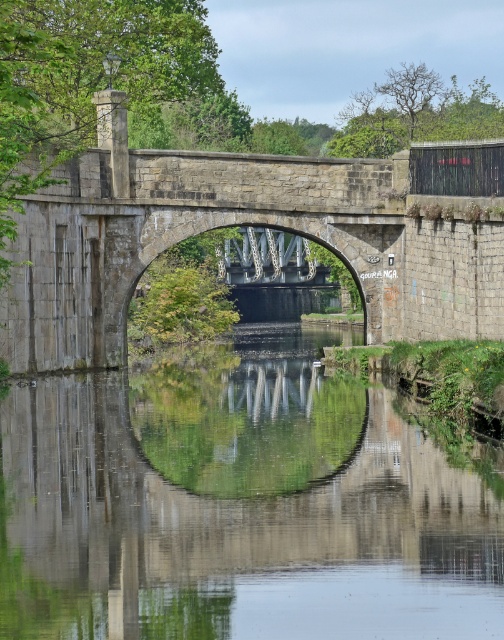
You are standing on the stone bridge at center and want to see the reflection of the bridge in the transparent water at center. Can you see the reflection clearly?

The transparent water at center is closer to the viewer than the stone bridge at center, so the reflection of the stone bridge at center in the transparent water at center may not be clearly visible due to the water being closer to the observer.

You are standing on the stone bridge at center and looking down at the transparent water at center. Which one takes up more visual space in your view?

The stone bridge at center takes up more visual space than the transparent water at center because the transparent water at center occupies less space than stone bridge at center.